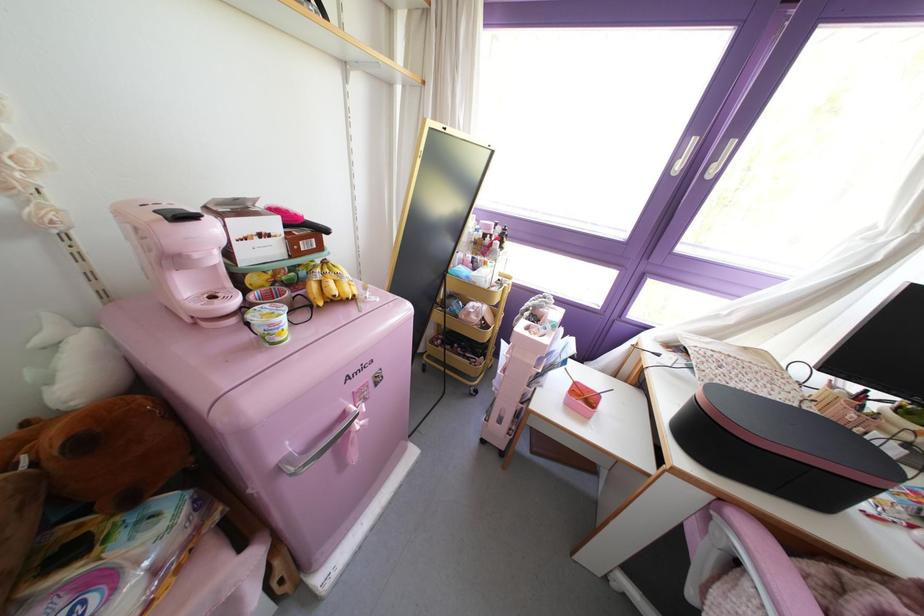
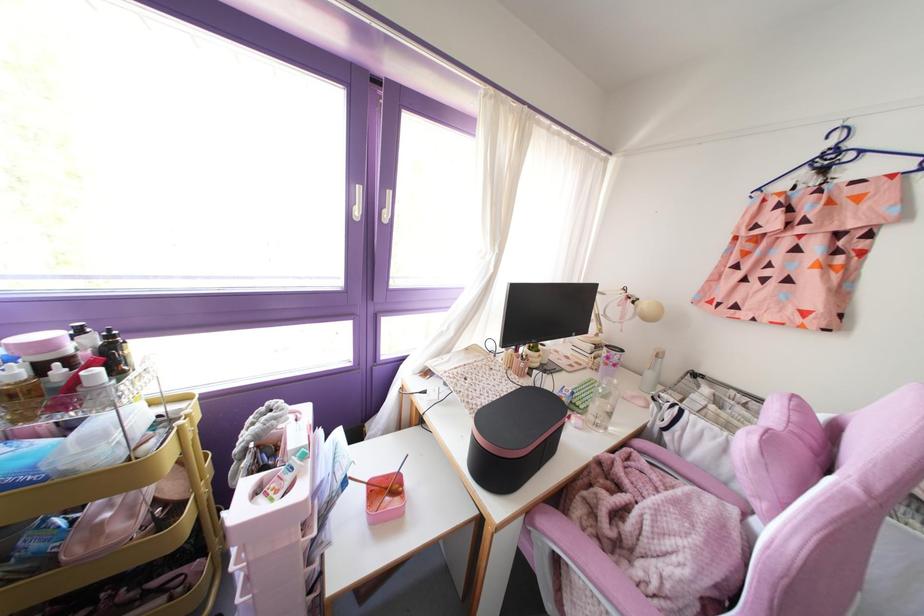
In the second image, find the point that corresponds to point 501,246 in the first image.

(116, 373)